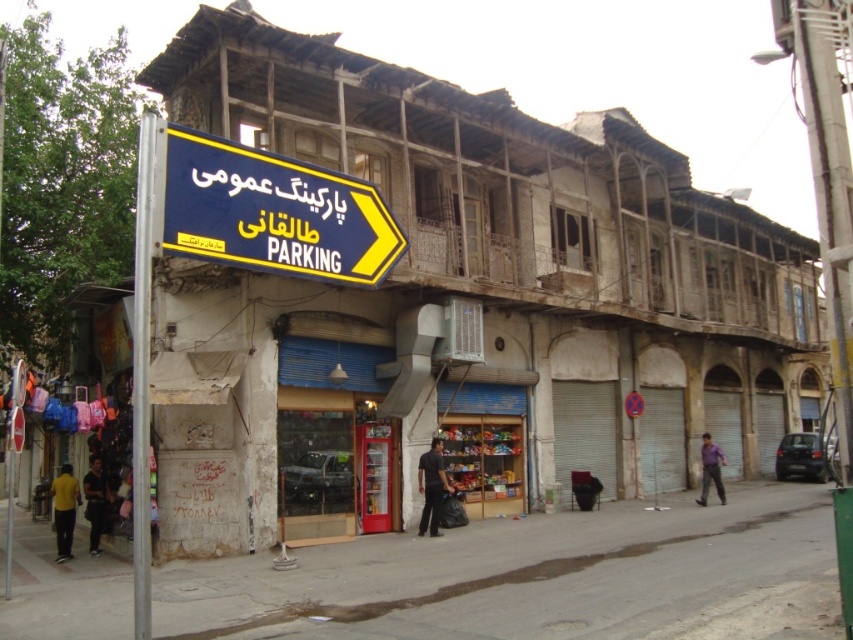
You are a photographer standing at the camera position. You want to take a photo of the blue painted metal signboard at upper left. Is the signboard within your camera range if the maximum range is 10 meters?

The blue painted metal signboard at upper left and camera are 11.45 meters apart, which exceeds the camera range of 10 meters. Therefore, the signboard is out of range.

You are a tourist holding a camera that has a maximum zoom of 5 meters. You want to take a photo of both the blue painted metal signboard at upper left and the blue plastic sign at upper left. Can your camera capture both signs in the same frame without moving closer?

The blue painted metal signboard at upper left is 7.54 meters away from the blue plastic sign at upper left. Since your camera can only zoom up to 5 meters, it cannot capture both signs in the same frame without moving closer because the distance between them exceeds the maximum zoom range.